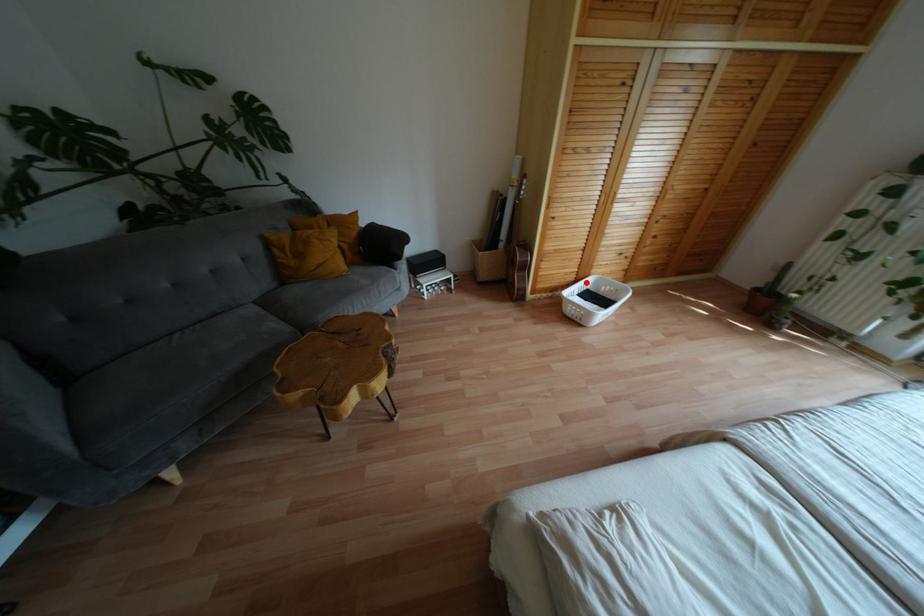
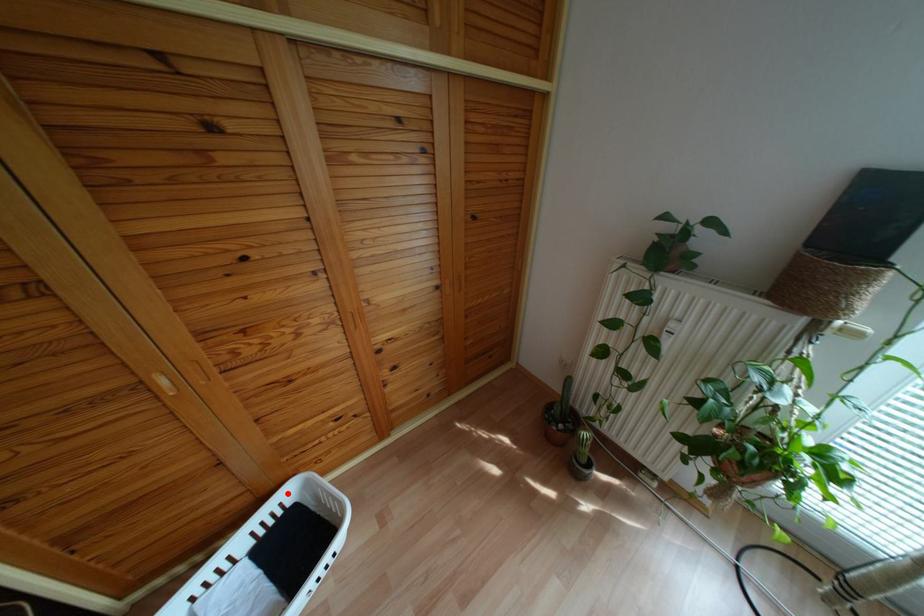
I am providing you with two images of the same scene from different viewpoints. A red point is marked on the first image and another point is marked on the second image. Does the point marked in image1 correspond to the same location as the one in image2?

Yes